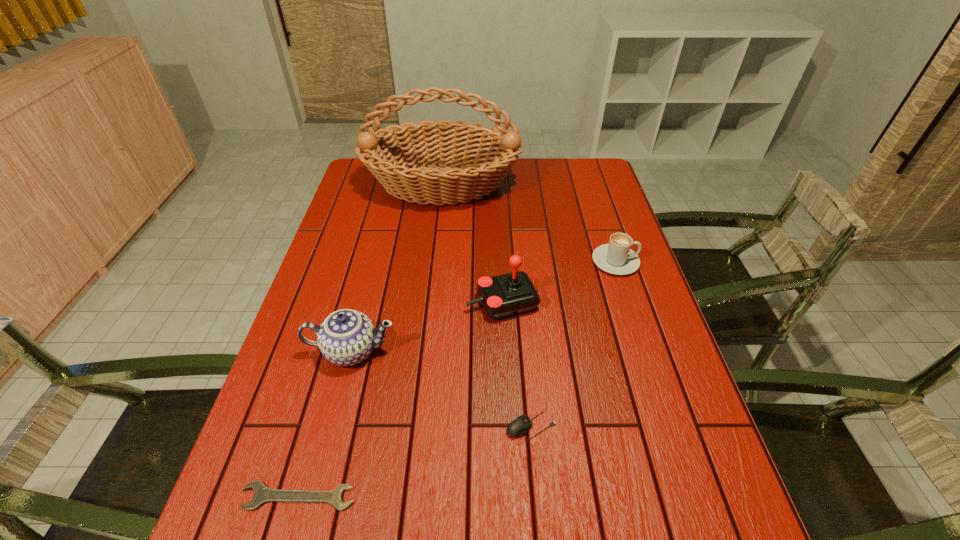
You are a GUI agent. You are given a task and a screenshot of the screen. Output one action in this format:
    pyautogui.click(x=<x>, y=<y>)
    Task: Click on the wrench at the left edge
    This screenshot has height=540, width=960.
    Given the screenshot: What is the action you would take?
    pyautogui.click(x=263, y=494)

Identify the location of object at the right edge. The height and width of the screenshot is (540, 960). (617, 258).

At what (x,y) coordinates should I click in order to perform the action: click on object present at the far left corner. Please return your answer as a coordinate pair (x, y). Looking at the image, I should click on (400, 167).

This screenshot has width=960, height=540. I want to click on vacant space at the far edge, so click(x=554, y=181).

This screenshot has height=540, width=960. In the image, there is a desktop. Find the location of `vacant area at the left edge`. vacant area at the left edge is located at coordinates (312, 360).

At what (x,y) coordinates should I click in order to perform the action: click on free point at the right edge. Please return your answer as a coordinate pair (x, y). The image size is (960, 540). Looking at the image, I should click on (622, 389).

Where is `vacant space that's between the third nearest object and the mouse`? vacant space that's between the third nearest object and the mouse is located at coordinates (442, 388).

At what (x,y) coordinates should I click in order to perform the action: click on vacant area that lies between the fourth tallest object and the fifth farthest object. Please return your answer as a coordinate pair (x, y). The width and height of the screenshot is (960, 540). Looking at the image, I should click on (573, 343).

Identify the location of vacant area that lies between the second farthest object and the fourth nearest object. This screenshot has height=540, width=960. (559, 282).

At what (x,y) coordinates should I click in order to perform the action: click on free spot between the tallest object and the fifth shortest object. Please return your answer as a coordinate pair (x, y). The height and width of the screenshot is (540, 960). Looking at the image, I should click on (472, 244).